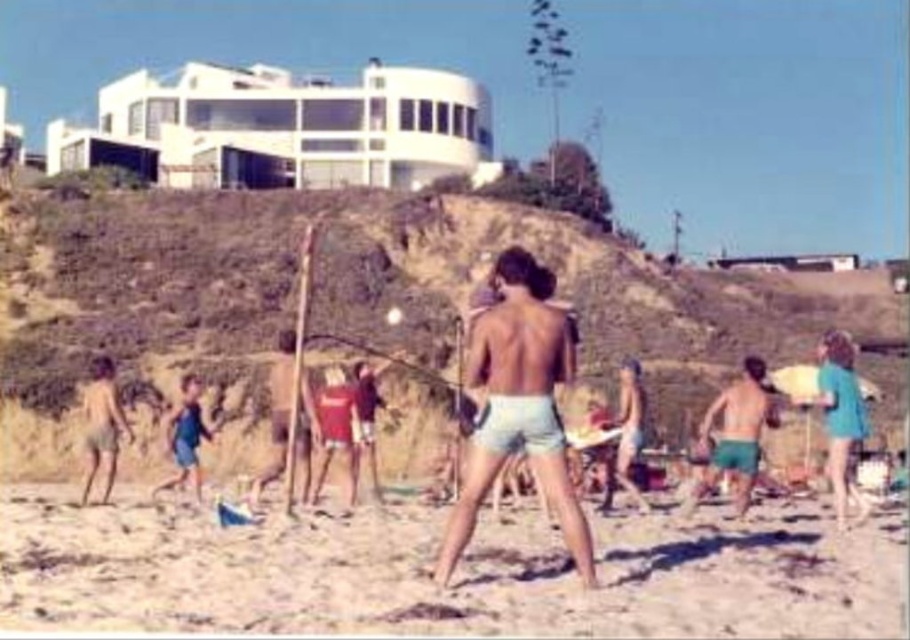
Measure the distance from light blue denim shorts at center to blue fabric surfboard at right.

28.87 meters

Is point (504, 280) in front of point (844, 474)?

Yes, it is in front of point (844, 474).

This screenshot has width=910, height=640. Identify the location of light blue denim shorts at center. [x=518, y=404].

Who is taller, light brown sand at center or green cotton shorts at right?

Standing taller between the two is green cotton shorts at right.

Does light brown sand at center appear on the left side of green cotton shorts at right?

Correct, you'll find light brown sand at center to the left of green cotton shorts at right.

Is point (339, 608) closer to camera compared to point (723, 468)?

That is True.

You are a GUI agent. You are given a task and a screenshot of the screen. Output one action in this format:
    pyautogui.click(x=<x>, y=<y>)
    Task: Click on the light brown sand at center
    The width and height of the screenshot is (910, 640).
    Given the screenshot: What is the action you would take?
    pyautogui.click(x=452, y=580)

Can you confirm if green cotton shorts at right is taller than tan skin child at left?

Indeed, green cotton shorts at right has a greater height compared to tan skin child at left.

Is point (744, 458) positioned behind point (91, 436)?

That is False.

Find the location of a particular element. green cotton shorts at right is located at coordinates (737, 433).